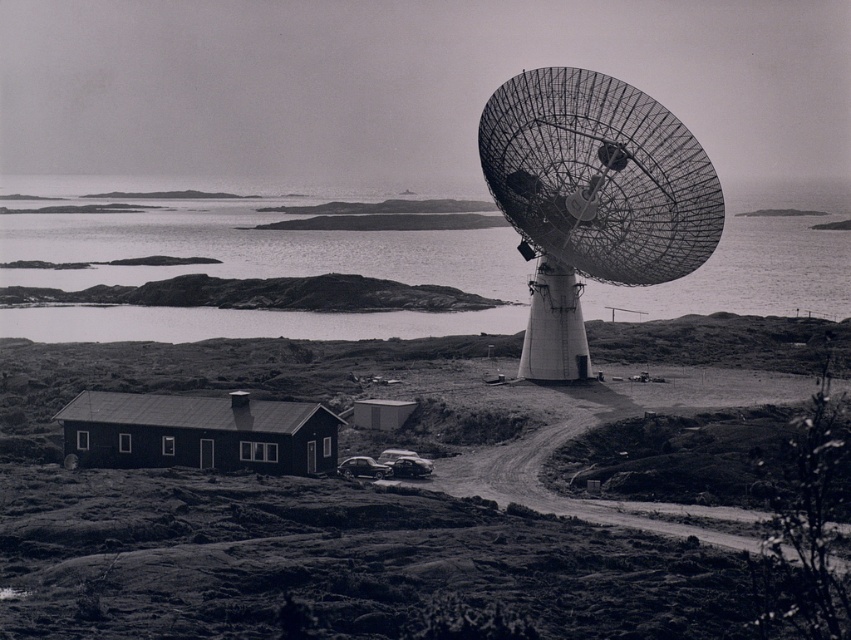
Question: Which object is closer to the camera taking this photo?

Choices:
 (A) reflective silver water at upper center
 (B) shiny black car at center
 (C) metallic grid satellite at right

Answer: (B)

Question: Which of the following is the closest to the observer?

Choices:
 (A) shiny black car at center
 (B) metallic grid satellite at right

Answer: (A)

Question: Which point is closer to the camera taking this photo?

Choices:
 (A) (236, 268)
 (B) (501, 131)

Answer: (B)

Question: In this image, where is reflective silver water at upper center located relative to metallic grid satellite at right?

Choices:
 (A) right
 (B) left

Answer: (A)

Question: Does reflective silver water at upper center lie in front of metallic grid satellite at right?

Choices:
 (A) no
 (B) yes

Answer: (A)

Question: Can you confirm if metallic grid satellite at right is wider than shiny black car at center?

Choices:
 (A) yes
 (B) no

Answer: (A)